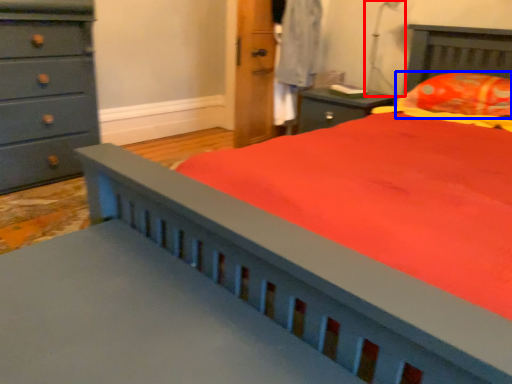
Question: Among these objects, which one is nearest to the camera, table lamp (highlighted by a red box) or pillow (highlighted by a blue box)?

Choices:
 (A) table lamp
 (B) pillow

Answer: (B)